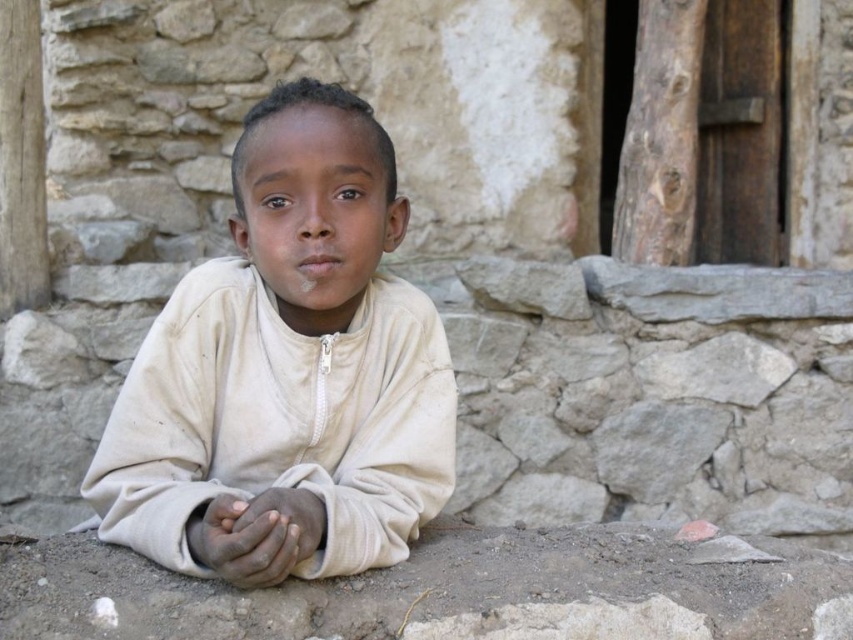
You are a photographer trying to capture the child in the scene. The white matte shirt at center and dark brown skin at center are both visible in your frame. Which object takes up more space in the photo?

The white matte shirt at center takes up more space in the photo because it has a larger size compared to the dark brown skin at center.

Based on the scene description, which object is wider, the dark brown skin at center or the smooth skin hands at center?

The dark brown skin at center is wider than the smooth skin hands at center according to the description.